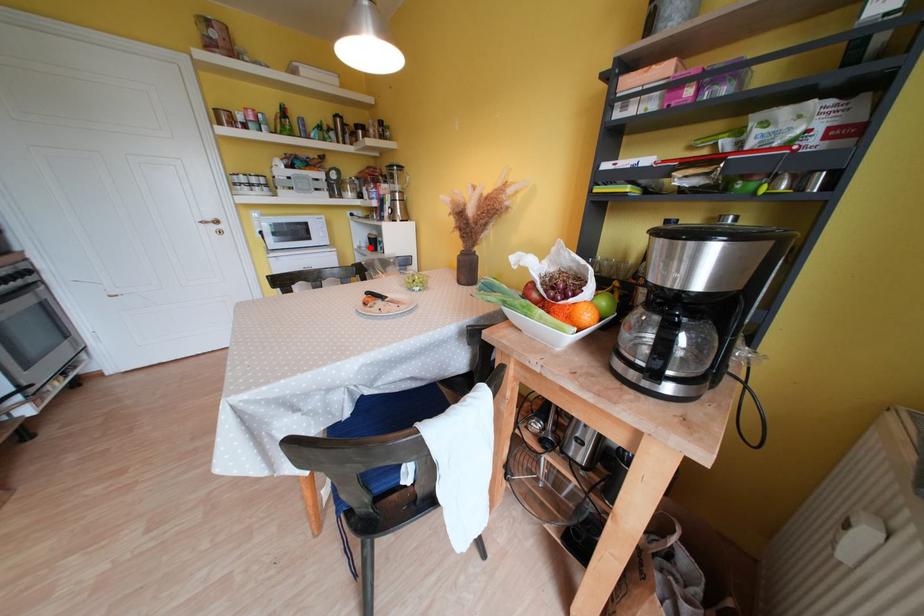
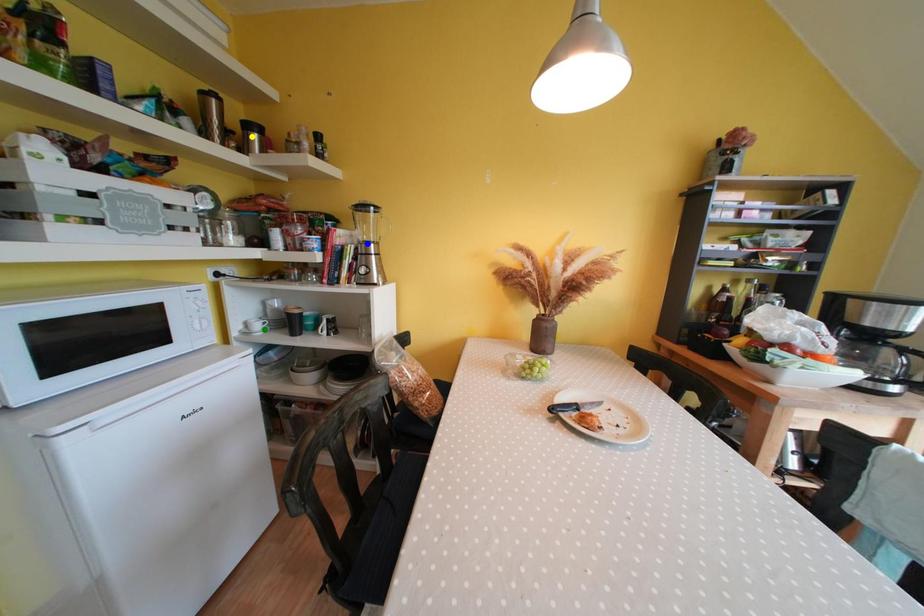
Question: I am providing you with two images of the same scene from different viewpoints. A red point is marked on the first image. You are given multiple points on the second image. Which spot in image 2 lines up with the point in image 1?

Choices:
 (A) yellow point
 (B) blue point
 (C) green point

Answer: (C)